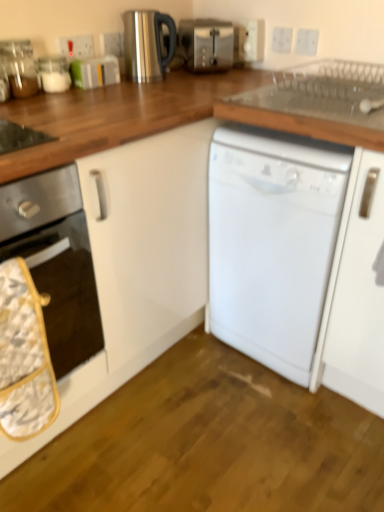
In order to face white plastic electric outlet at upper center, arranged as the third electric outlet when viewed from the left, should I rotate leftwards or rightwards?

A 7.647 degree turn to the right will do.

Locate an element on the screen. white glossy oven at left is located at coordinates (55, 260).

Image resolution: width=384 pixels, height=512 pixels. I want to click on white glossy jar at upper left, marked as the second appliance in a right-to-left arrangement, so click(x=54, y=73).

Describe the element at coordinates (54, 73) in the screenshot. I see `white glossy jar at upper left, marked as the second appliance in a right-to-left arrangement` at that location.

Measure the distance between point [215,58] and camera.

Point [215,58] is 5.39 feet from camera.

At what (x,y) coordinates should I click in order to perform the action: click on white plastic electric outlet at upper center, the fourth electric outlet when ordered from left to right. Please return your answer as a coordinate pair (x, y). This screenshot has width=384, height=512. Looking at the image, I should click on (282, 39).

The width and height of the screenshot is (384, 512). What do you see at coordinates (272, 242) in the screenshot?
I see `white matte dishwasher at center` at bounding box center [272, 242].

Locate an element on the screen. white plastic electric outlet at upper center, arranged as the third electric outlet when viewed from the left is located at coordinates (251, 40).

Can you confirm if clear glass jar at upper left, the third appliance viewed from the right, is wider than white glossy oven at left?

In fact, clear glass jar at upper left, the third appliance viewed from the right, might be narrower than white glossy oven at left.

From the image's perspective, who appears lower, clear glass jar at upper left, the 1th appliance in the left-to-right sequence, or white glossy oven at left?

From the image's view, white glossy oven at left is below.

From the picture: Is white glossy oven at left a part of clear glass jar at upper left, the third appliance viewed from the right?

No.

Which object is closer to the camera taking this photo, clear glass jar at upper left, the third appliance viewed from the right, or white glossy oven at left?

white glossy oven at left is closer to the camera.

Could you tell me if stainless steel kettle at upper center, positioned as the first appliance in right-to-left order, is facing white glossy oven at left?

No, stainless steel kettle at upper center, positioned as the first appliance in right-to-left order, is not turned towards white glossy oven at left.

Does stainless steel kettle at upper center, the 3th appliance in the left-to-right sequence, have a lesser width compared to white glossy oven at left?

Correct, the width of stainless steel kettle at upper center, the 3th appliance in the left-to-right sequence, is less than that of white glossy oven at left.

Is stainless steel kettle at upper center, the 3th appliance in the left-to-right sequence, surrounding white glossy oven at left?

No, white glossy oven at left is located outside of stainless steel kettle at upper center, the 3th appliance in the left-to-right sequence.

Looking at this image, from a real-world perspective, is stainless steel kettle at upper center, positioned as the first appliance in right-to-left order, physically located above or below white glossy oven at left?

stainless steel kettle at upper center, positioned as the first appliance in right-to-left order, is above white glossy oven at left.

Considering the positions of points (278, 30) and (112, 42), is point (278, 30) farther from camera compared to point (112, 42)?

Yes, point (278, 30) is farther from viewer.

From a real-world perspective, is white plastic electric outlet at upper center, the fourth electric outlet when ordered from left to right, physically located above or below white plastic electric outlet at upper center, which is counted as the 4th electric outlet, starting from the right?

From a real-world perspective, white plastic electric outlet at upper center, the fourth electric outlet when ordered from left to right, is physically below white plastic electric outlet at upper center, which is counted as the 4th electric outlet, starting from the right.

Looking at this image, is white plastic electric outlet at upper center, the fourth electric outlet when ordered from left to right, oriented towards white plastic electric outlet at upper center, which is counted as the 4th electric outlet, starting from the right?

No, white plastic electric outlet at upper center, the fourth electric outlet when ordered from left to right, does not turn towards white plastic electric outlet at upper center, which is counted as the 4th electric outlet, starting from the right.

Who is shorter, white plastic electric outlet at upper center, the 2th electric outlet viewed from the right, or white plastic electric outlet at upper center, the second electric outlet in the left-to-right sequence?

With less height is white plastic electric outlet at upper center, the 2th electric outlet viewed from the right.

Considering the sizes of objects white plastic electric outlet at upper center, the 2th electric outlet viewed from the right, and white plastic electric outlet at upper center, which appears as the 1th electric outlet when viewed from the right, in the image provided, who is bigger, white plastic electric outlet at upper center, the 2th electric outlet viewed from the right, or white plastic electric outlet at upper center, which appears as the 1th electric outlet when viewed from the right,?

Bigger between the two is white plastic electric outlet at upper center, the 2th electric outlet viewed from the right.

How different are the orientations of white plastic electric outlet at upper center, the fourth electric outlet when ordered from left to right, and white plastic electric outlet at upper center, which appears as the 1th electric outlet when viewed from the right, in degrees?

The facing directions of white plastic electric outlet at upper center, the fourth electric outlet when ordered from left to right, and white plastic electric outlet at upper center, which appears as the 1th electric outlet when viewed from the right, are 0.000382 degrees apart.

Who is shorter, white plastic electric outlet at upper center, the 2th electric outlet viewed from the right, or white plastic electric outlet at upper center, which appears as the 1th electric outlet when viewed from the right?

white plastic electric outlet at upper center, which appears as the 1th electric outlet when viewed from the right.

The image size is (384, 512). I want to click on the 2nd electric outlet in front of the white plastic electric outlet at upper center, the 2th electric outlet viewed from the right, so click(x=306, y=42).

Is stainless steel kettle at upper center, positioned as the first appliance in right-to-left order, smaller than clear glass jar at upper left, the 1th appliance in the left-to-right sequence?

Actually, stainless steel kettle at upper center, positioned as the first appliance in right-to-left order, might be larger than clear glass jar at upper left, the 1th appliance in the left-to-right sequence.

From the image's perspective, is stainless steel kettle at upper center, positioned as the first appliance in right-to-left order, located above or below clear glass jar at upper left, the 1th appliance in the left-to-right sequence?

stainless steel kettle at upper center, positioned as the first appliance in right-to-left order, is above clear glass jar at upper left, the 1th appliance in the left-to-right sequence.

Relative to clear glass jar at upper left, the third appliance viewed from the right, is stainless steel kettle at upper center, positioned as the first appliance in right-to-left order, in front or behind?

stainless steel kettle at upper center, positioned as the first appliance in right-to-left order, is behind clear glass jar at upper left, the third appliance viewed from the right.

From a real-world perspective, is white glossy oven at left positioned over white plastic electric outlet at upper center, which appears as the 1th electric outlet when viewed from the right, based on gravity?

No.

Considering their positions, is white glossy oven at left located in front of or behind white plastic electric outlet at upper center, marked as the fifth electric outlet in a left-to-right arrangement?

Visually, white glossy oven at left is located in front of white plastic electric outlet at upper center, marked as the fifth electric outlet in a left-to-right arrangement.

Considering the points (9, 237) and (303, 38), which point is behind, point (9, 237) or point (303, 38)?

Positioned behind is point (303, 38).

Is white glossy oven at left at the right side of white plastic electric outlet at upper center, marked as the fifth electric outlet in a left-to-right arrangement?

No, white glossy oven at left is not to the right of white plastic electric outlet at upper center, marked as the fifth electric outlet in a left-to-right arrangement.

Is point (66, 271) behind point (70, 39)?

No.

In the scene shown: Could you tell me if white glossy oven at left is turned towards white plastic electric outlet at upper center, which is the fifth electric outlet from right to left?

No, white glossy oven at left is not aimed at white plastic electric outlet at upper center, which is the fifth electric outlet from right to left.

Is white glossy oven at left to the left or to the right of white plastic electric outlet at upper center, which is the fifth electric outlet from right to left, in the image?

In the image, white glossy oven at left appears on the left side of white plastic electric outlet at upper center, which is the fifth electric outlet from right to left.

In the image, there is a clear glass jar at upper left, the 1th appliance in the left-to-right sequence. Where is `kitchen appliance below it (from a real-world perspective)`? This screenshot has height=512, width=384. kitchen appliance below it (from a real-world perspective) is located at coordinates (55, 260).

The height and width of the screenshot is (512, 384). I want to click on the 3rd appliance directly above the white glossy oven at left (from a real-world perspective), so click(x=146, y=44).

When comparing their distances from white plastic electric outlet at upper center, marked as the fifth electric outlet in a left-to-right arrangement, does white glossy jar at upper left, marked as the second appliance in a right-to-left arrangement, or clear glass jar at upper left, the 1th appliance in the left-to-right sequence, seem closer?

Based on the image, white glossy jar at upper left, marked as the second appliance in a right-to-left arrangement, appears to be nearer to white plastic electric outlet at upper center, marked as the fifth electric outlet in a left-to-right arrangement.

In the scene shown: Looking at the image, which one is located closer to white plastic electric outlet at upper center, which appears as the 1th electric outlet when viewed from the right, stainless steel kettle at upper center, the 3th appliance in the left-to-right sequence, or white glossy jar at upper left, the second appliance positioned from the left?

stainless steel kettle at upper center, the 3th appliance in the left-to-right sequence, lies closer to white plastic electric outlet at upper center, which appears as the 1th electric outlet when viewed from the right, than the other object.

Consider the image. Considering their positions, is white plastic electric outlet at upper center, which is counted as the 4th electric outlet, starting from the right, positioned closer to white plastic electric outlet at upper center, which appears as the first electric outlet when viewed from the left, than white plastic electric outlet at upper center, the 3th electric outlet from the right?

white plastic electric outlet at upper center, which is counted as the 4th electric outlet, starting from the right, is positioned closer to the anchor white plastic electric outlet at upper center, which appears as the first electric outlet when viewed from the left.

Based on their spatial positions, is clear glass jar at upper left, the 1th appliance in the left-to-right sequence, or white plastic electric outlet at upper center, arranged as the third electric outlet when viewed from the left, further from white plastic electric outlet at upper center, which appears as the first electric outlet when viewed from the left?

white plastic electric outlet at upper center, arranged as the third electric outlet when viewed from the left, is further to white plastic electric outlet at upper center, which appears as the first electric outlet when viewed from the left.

Estimate the real-world distances between objects in this image. Which object is closer to clear glass jar at upper left, the 1th appliance in the left-to-right sequence, white plastic electric outlet at upper center, which appears as the 1th electric outlet when viewed from the right, or white plastic electric outlet at upper center, which is the fifth electric outlet from right to left?

white plastic electric outlet at upper center, which is the fifth electric outlet from right to left.

Looking at the image, which one is located further to white plastic electric outlet at upper center, the 3th electric outlet from the right, white glossy oven at left or white plastic electric outlet at upper center, which appears as the first electric outlet when viewed from the left?

white glossy oven at left lies further to white plastic electric outlet at upper center, the 3th electric outlet from the right, than the other object.

Estimate the real-world distances between objects in this image. Which object is closer to white glossy oven at left, satin silver toaster at upper center or clear glass jar at upper left, the third appliance viewed from the right?

Among the two, clear glass jar at upper left, the third appliance viewed from the right, is located nearer to white glossy oven at left.

Considering their positions, is white plastic electric outlet at upper center, the second electric outlet in the left-to-right sequence, positioned closer to white plastic electric outlet at upper center, which appears as the 1th electric outlet when viewed from the right, than white plastic electric outlet at upper center, which appears as the first electric outlet when viewed from the left?

white plastic electric outlet at upper center, the second electric outlet in the left-to-right sequence, lies closer to white plastic electric outlet at upper center, which appears as the 1th electric outlet when viewed from the right, than the other object.

In order to click on toaster situated between stainless steel kettle at upper center, positioned as the first appliance in right-to-left order, and white plastic electric outlet at upper center, the 2th electric outlet viewed from the right, from left to right in this screenshot , I will do `click(206, 44)`.

In order to click on toaster between white glossy jar at upper left, marked as the second appliance in a right-to-left arrangement, and white plastic electric outlet at upper center, the 3th electric outlet from the right, from left to right in this screenshot , I will do `click(206, 44)`.

Locate an element on the screen. The width and height of the screenshot is (384, 512). appliance between white glossy jar at upper left, the second appliance positioned from the left, and white plastic electric outlet at upper center, arranged as the third electric outlet when viewed from the left, in the horizontal direction is located at coordinates (146, 44).

The image size is (384, 512). What are the coordinates of `toaster located between stainless steel kettle at upper center, positioned as the first appliance in right-to-left order, and white plastic electric outlet at upper center, arranged as the third electric outlet when viewed from the left, in the left-right direction` in the screenshot? It's located at (206, 44).